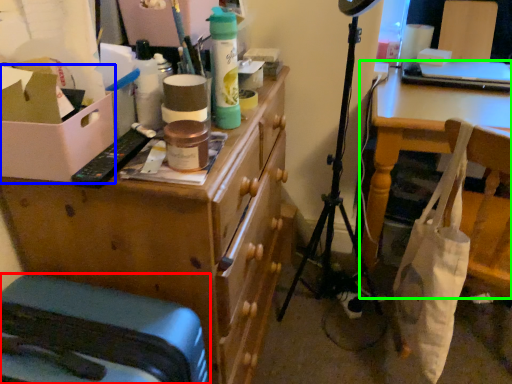
Question: Based on their relative distances, which object is farther from furniture (highlighted by a red box)? Choose from cardboard box (highlighted by a blue box) and table (highlighted by a green box).

Choices:
 (A) cardboard box
 (B) table

Answer: (B)